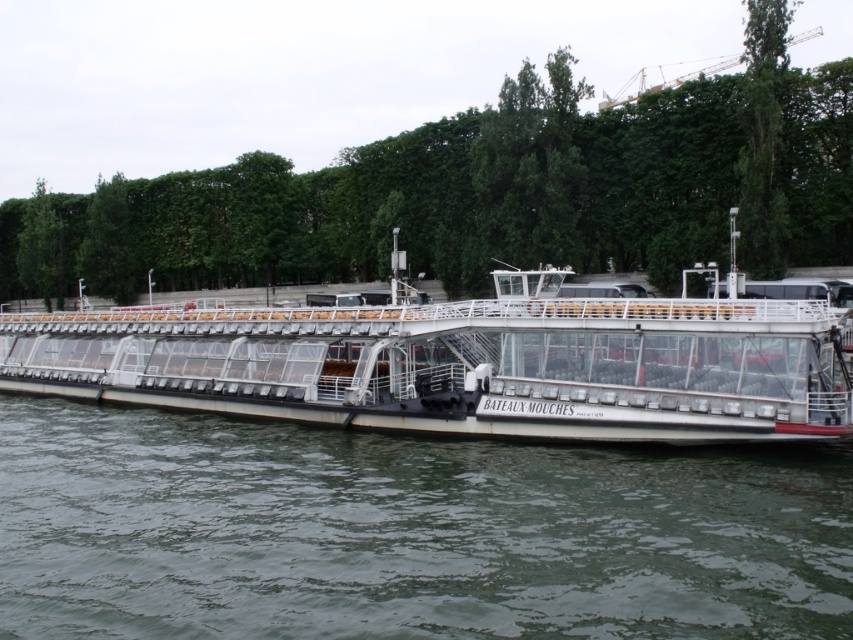
Question: Is white glossy water at center above white matte boat at center?

Choices:
 (A) no
 (B) yes

Answer: (A)

Question: Which of the following is the farthest from the observer?

Choices:
 (A) white matte boat at center
 (B) white glossy water at center

Answer: (A)

Question: Is white glossy water at center wider than white matte boat at center?

Choices:
 (A) no
 (B) yes

Answer: (A)

Question: Which point is farther to the camera?

Choices:
 (A) (732, 472)
 (B) (595, 259)

Answer: (B)

Question: Is green leafy tree at center to the right of white matte boat at center from the viewer's perspective?

Choices:
 (A) no
 (B) yes

Answer: (A)

Question: Which point is closer to the camera taking this photo?

Choices:
 (A) (502, 540)
 (B) (32, 250)
 (C) (271, 401)

Answer: (A)